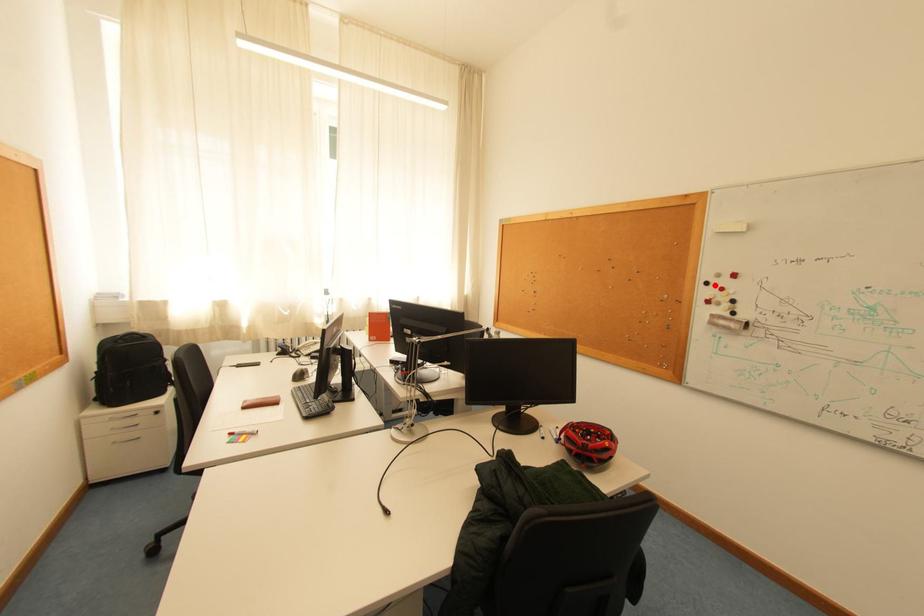
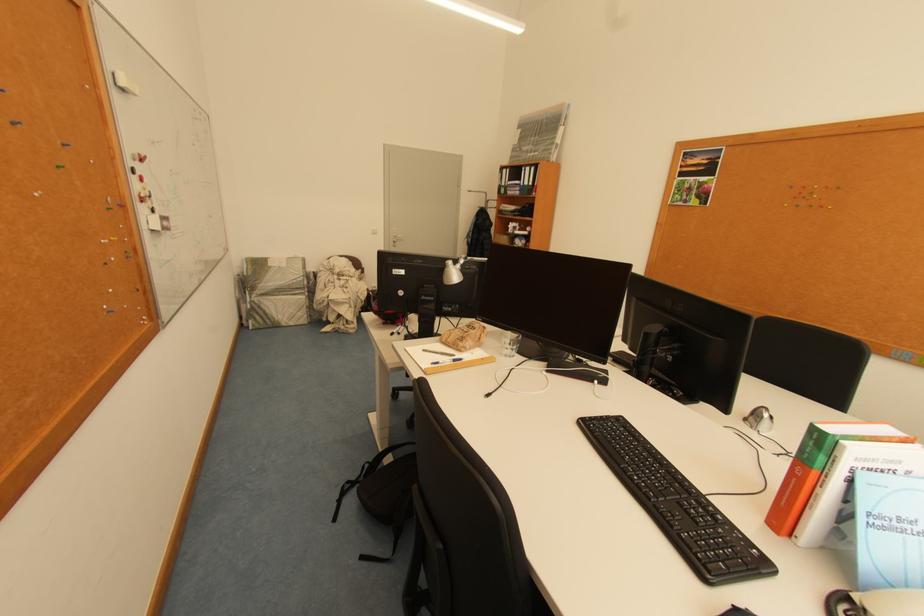
Where in the second image is the point corresponding to the highlighted location from the first image?

(141, 172)